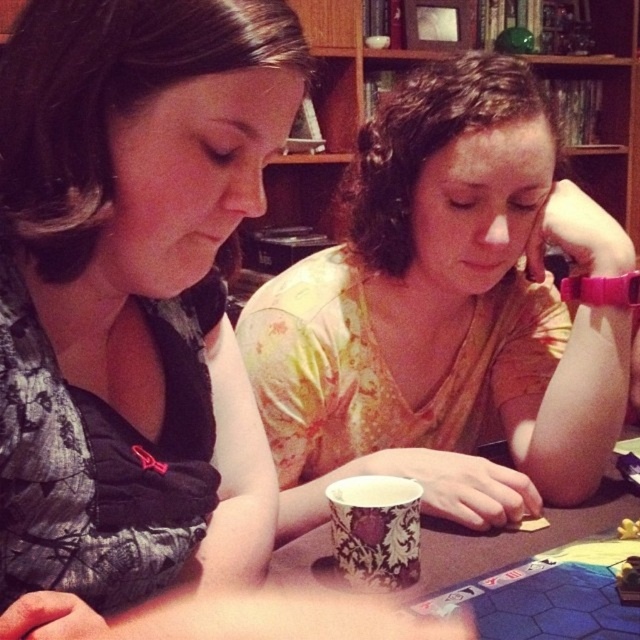
You are a delivery robot with a 5 inch wide package. You need to place the package between the matte yellow shirt at center and the white paper cup at center. Is there enough space for the package?

The matte yellow shirt at center and white paper cup at center are 6.78 inches apart. Since the package is 5 inches wide, there is enough space to place it between them.

You are a photographer trying to capture a closeup of the matte floral shirt at center. The camera you are using has a minimum focusing distance of 15 inches. Can you take the photo without moving the shirt?

The matte floral shirt at center is 15.19 inches away from camera. Since the minimum focusing distance is 15 inches, the camera can focus on the shirt as it is slightly beyond the minimum distance. Therefore, you can take the photo without moving the shirt.

You are standing in front of the table where two people are playing a board game. You notice two points marked on the table at coordinates point (548, 220) and point (486, 554). Which of these points is closer to you?

Point (548, 220) is further to the camera than point (486, 554), so the point closer to you is point (486, 554).